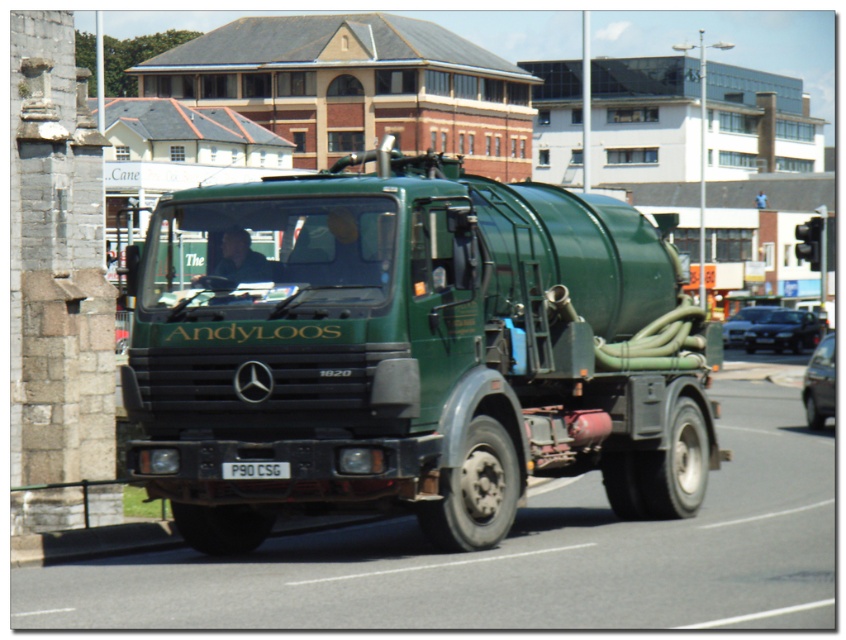
Question: Which point is closer to the camera taking this photo?

Choices:
 (A) (125, 452)
 (B) (276, 477)

Answer: (B)

Question: Which of the following is the closest to the observer?

Choices:
 (A) green matte truck at center
 (B) white plastic license plate at center

Answer: (A)

Question: Does green matte truck at center appear on the left side of white plastic license plate at center?

Choices:
 (A) yes
 (B) no

Answer: (B)

Question: Is green matte truck at center thinner than white plastic license plate at center?

Choices:
 (A) no
 (B) yes

Answer: (A)

Question: Can you confirm if green matte truck at center is positioned to the left of white plastic license plate at center?

Choices:
 (A) no
 (B) yes

Answer: (A)